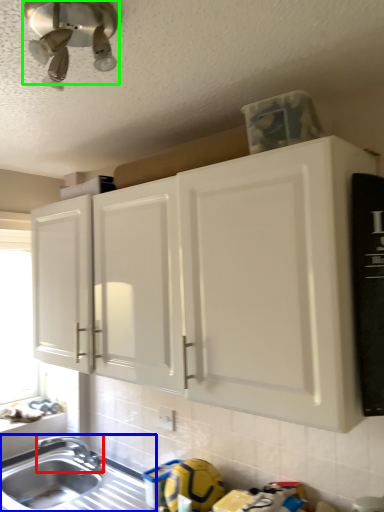
Question: Which object is positioned closest to tap (highlighted by a red box)? Select from sink (highlighted by a blue box) and light fixture (highlighted by a green box).

Choices:
 (A) sink
 (B) light fixture

Answer: (A)